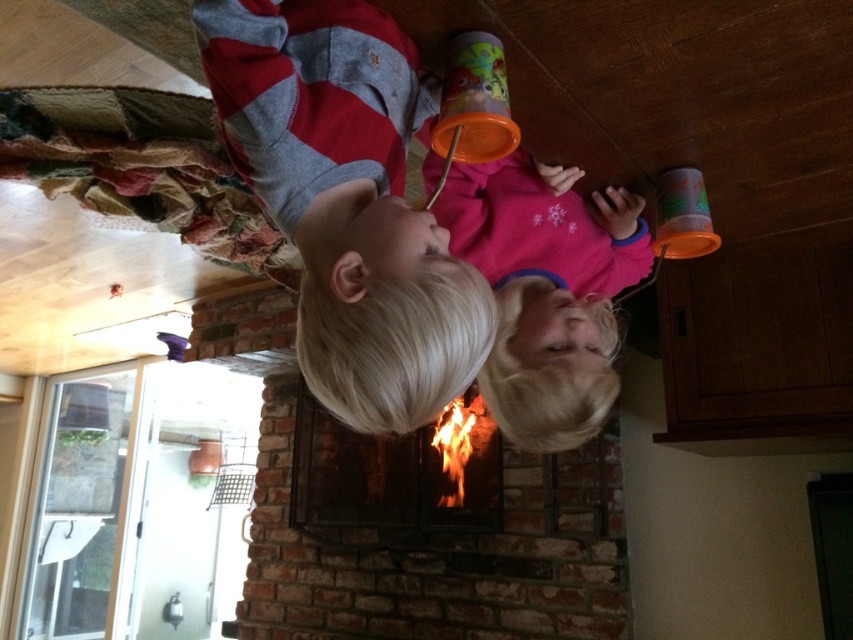
Question: Based on their relative distances, which object is nearer to the pink fleece sweater at center?

Choices:
 (A) matte gray sweater at center
 (B) brick fireplace at center

Answer: (A)

Question: Does matte gray sweater at center come behind pink fleece sweater at center?

Choices:
 (A) yes
 (B) no

Answer: (B)

Question: Is matte gray sweater at center to the right of pink fleece sweater at center from the viewer's perspective?

Choices:
 (A) yes
 (B) no

Answer: (B)

Question: Among these objects, which one is farthest from the camera?

Choices:
 (A) matte gray sweater at center
 (B) brick fireplace at center
 (C) pink fleece sweater at center

Answer: (B)

Question: Estimate the real-world distances between objects in this image. Which object is closer to the matte gray sweater at center?

Choices:
 (A) brick fireplace at center
 (B) pink fleece sweater at center

Answer: (B)

Question: Can you confirm if pink fleece sweater at center is smaller than brick fireplace at center?

Choices:
 (A) yes
 (B) no

Answer: (A)